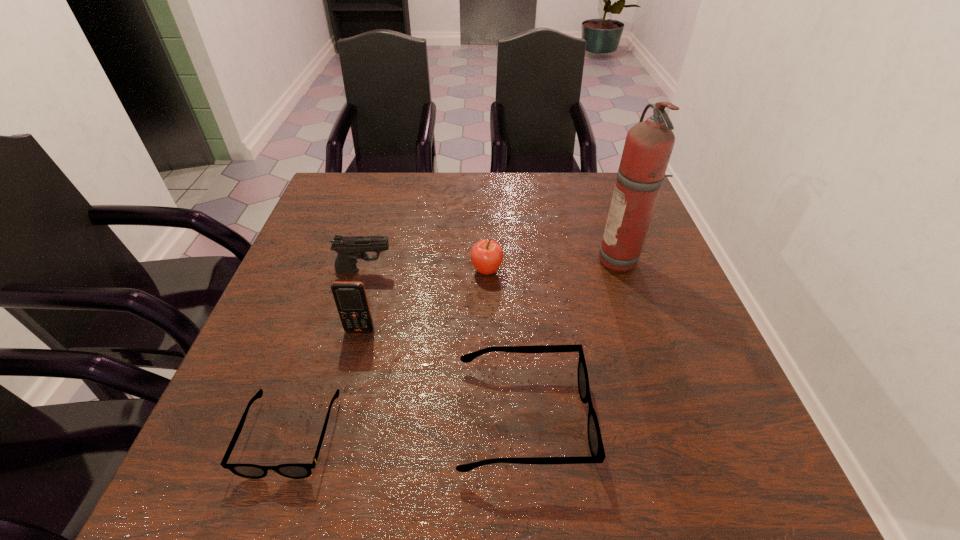
Find the location of a particular element. This screenshot has height=540, width=960. object situated at the near left corner is located at coordinates (295, 471).

I want to click on blank space at the far edge of the desktop, so click(x=544, y=185).

The image size is (960, 540). In the image, there is a desktop. Identify the location of blank space at the left edge. (289, 276).

What are the coordinates of `vacant region at the right edge of the desktop` in the screenshot? It's located at (658, 339).

Find the location of a particular element. This screenshot has height=540, width=960. free space at the near left corner of the desktop is located at coordinates (220, 412).

In the image, there is a desktop. Identify the location of free space at the far right corner. (592, 212).

You are a GUI agent. You are given a task and a screenshot of the screen. Output one action in this format:
    pyautogui.click(x=<x>, y=<y>)
    Task: Click on the vacant area that lies between the rightmost object and the shorter spectacles
    The image size is (960, 540).
    Given the screenshot: What is the action you would take?
    pyautogui.click(x=456, y=348)

Image resolution: width=960 pixels, height=540 pixels. What are the coordinates of `vacant region between the apple and the right spectacles` in the screenshot? It's located at (504, 345).

Where is `vacant point located between the apple and the cellular telephone`? vacant point located between the apple and the cellular telephone is located at coordinates (423, 300).

Locate an element on the screen. This screenshot has height=540, width=960. free space between the left spectacles and the taller spectacles is located at coordinates (407, 427).